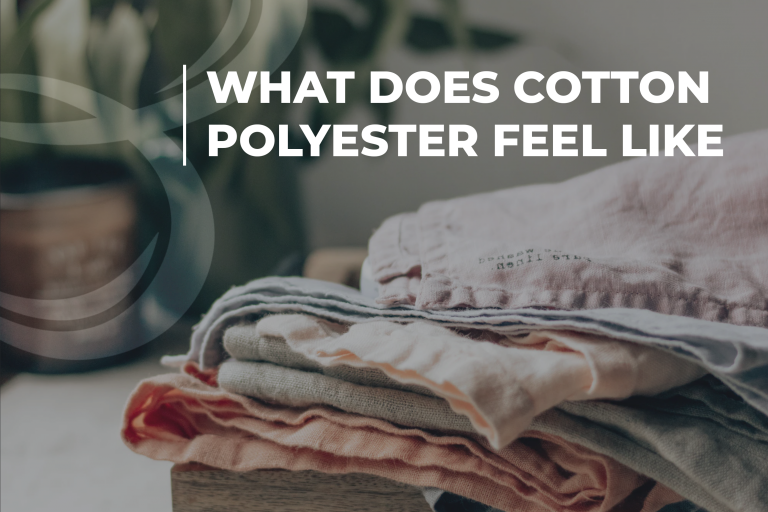
You are a GUI agent. You are given a task and a screenshot of the screen. Output one action in this format:
    pyautogui.click(x=<x>, y=<y>)
    Task: Click on the light blue towel
    
    Given the screenshot: What is the action you would take?
    pyautogui.click(x=339, y=391)